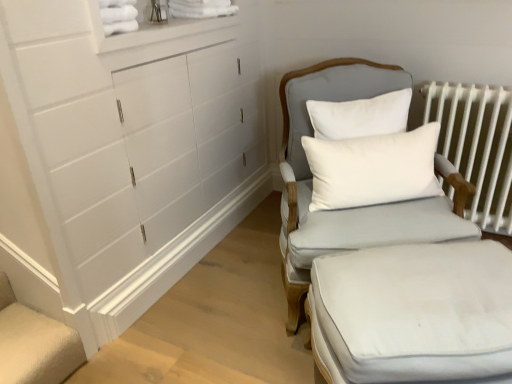
Image resolution: width=512 pixels, height=384 pixels. Find the location of `free location to the left of white fabric ottoman at lower right`. free location to the left of white fabric ottoman at lower right is located at coordinates (247, 339).